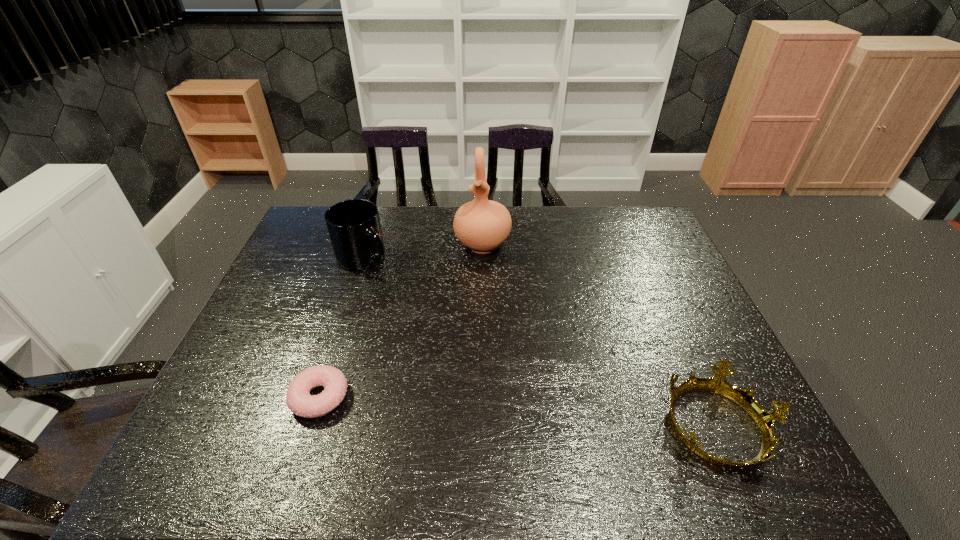
Identify the location of free space on the desktop that is between the shortest object and the rightmost object and is positioned with the handle on the side of the mug. (478, 409).

Identify the location of free space on the desktop that is between the doughnut and the rightmost object and is positioned on the spout of the tallest object. (471, 408).